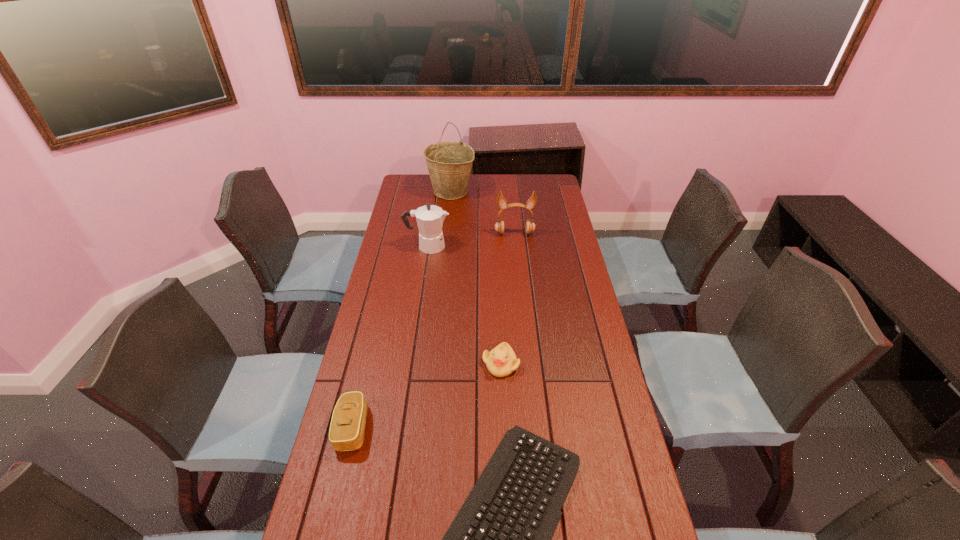
Find the location of a particular element. The image size is (960, 540). wine bucket is located at coordinates (449, 163).

I want to click on the farthest object, so click(449, 163).

Where is `the second farthest object`? This screenshot has height=540, width=960. the second farthest object is located at coordinates (501, 201).

Locate an element on the screen. coffeepot is located at coordinates point(430,218).

What are the coordinates of `the third nearest object` in the screenshot? It's located at (501, 361).

In order to click on clutch bag in this screenshot , I will do `click(347, 427)`.

Image resolution: width=960 pixels, height=540 pixels. In order to click on free region located on the front of the farthest object in this screenshot , I will do `click(448, 218)`.

Where is `free space located on the front-facing side of the earphone`? free space located on the front-facing side of the earphone is located at coordinates (516, 254).

Image resolution: width=960 pixels, height=540 pixels. I want to click on free spot located at the spout of the coffeepot, so click(510, 246).

Identify the location of blank space located 0.360m at the face of the fourth farthest object. (507, 499).